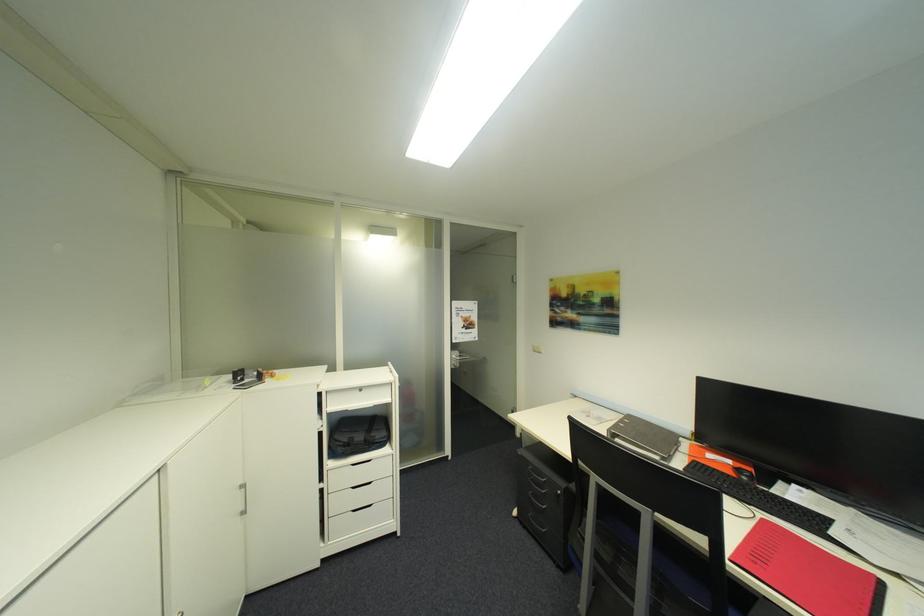
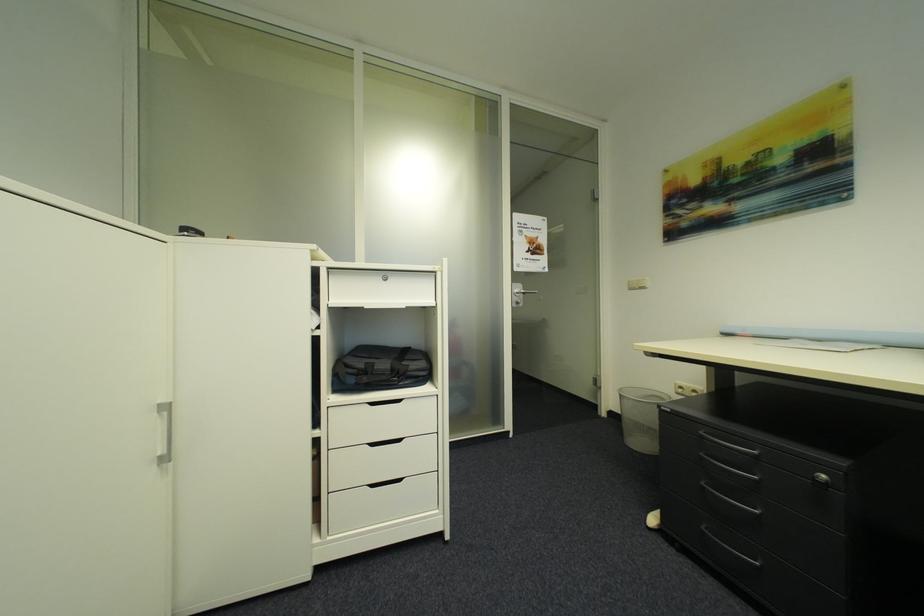
The images are taken continuously from a first-person perspective. In which direction are you moving?

The cameraman walked toward left, forward.